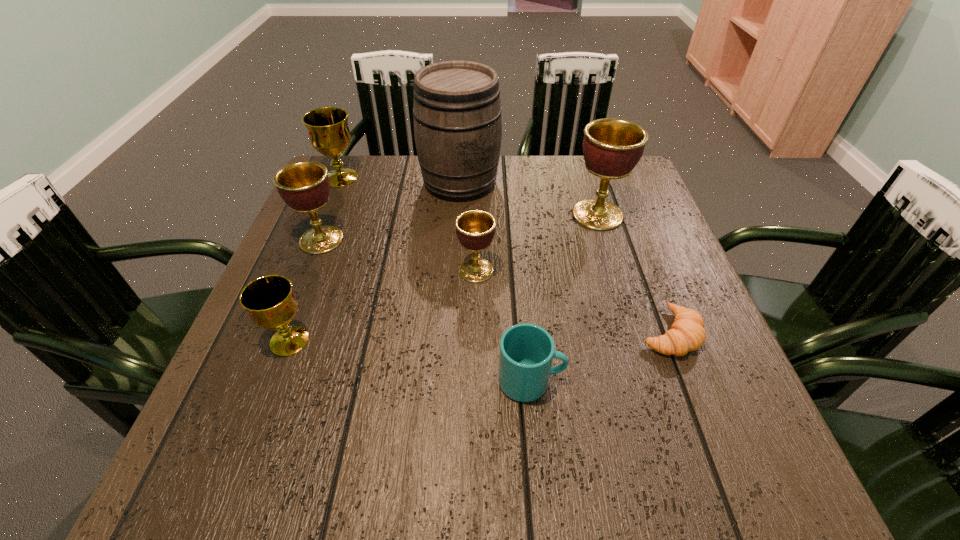
Locate an element on the screen. wine bucket positioned at the far edge is located at coordinates (x=457, y=112).

The image size is (960, 540). What are the coordinates of `chalice that is at the right edge` in the screenshot? It's located at (612, 147).

This screenshot has width=960, height=540. I want to click on crescent roll that is positioned at the right edge, so click(x=687, y=333).

In order to click on object that is at the far left corner in this screenshot , I will do `click(329, 134)`.

Find the location of a particular element. The image size is (960, 540). object that is positioned at the far right corner is located at coordinates (612, 147).

The height and width of the screenshot is (540, 960). Identify the location of vacant space at the far edge. (524, 163).

The width and height of the screenshot is (960, 540). Find the location of `free space at the near edge of the desktop`. free space at the near edge of the desktop is located at coordinates (596, 469).

Where is `free space at the left edge of the desktop`? The image size is (960, 540). free space at the left edge of the desktop is located at coordinates (317, 365).

At what (x,y) coordinates should I click in order to perform the action: click on vacant space at the right edge. Please return your answer as a coordinate pair (x, y). This screenshot has height=540, width=960. Looking at the image, I should click on (638, 338).

You are a GUI agent. You are given a task and a screenshot of the screen. Output one action in this format:
    pyautogui.click(x=<x>, y=<y>)
    Task: Click on the blank space at the far right corner of the desktop
    This screenshot has width=960, height=540.
    Given the screenshot: What is the action you would take?
    pyautogui.click(x=614, y=183)